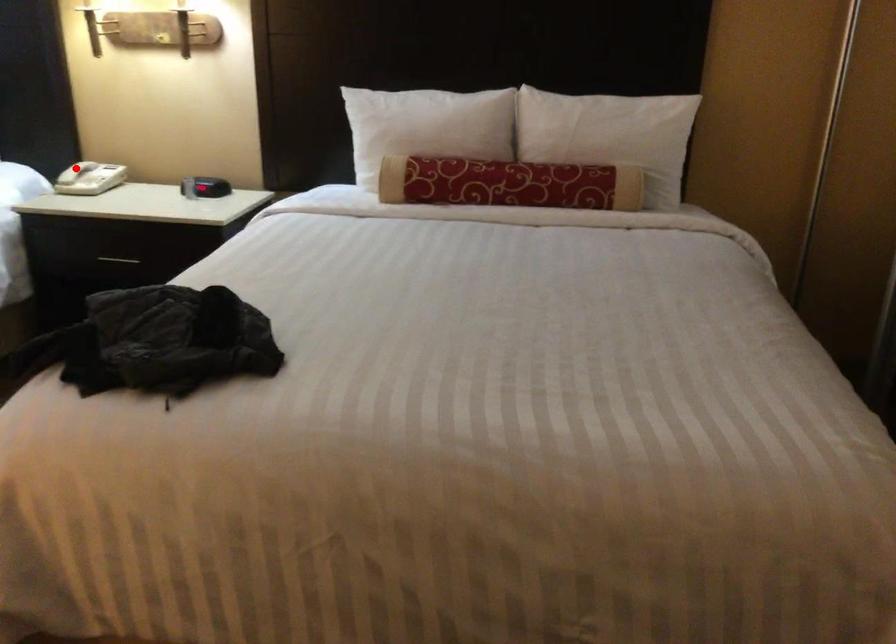
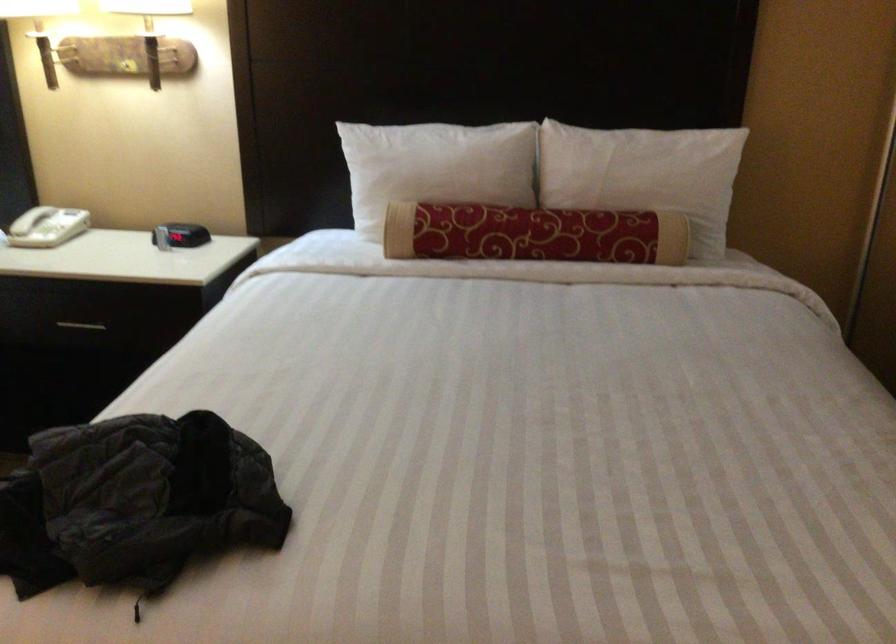
Where in the second image is the point corresponding to the highlighted location from the first image?

(30, 220)